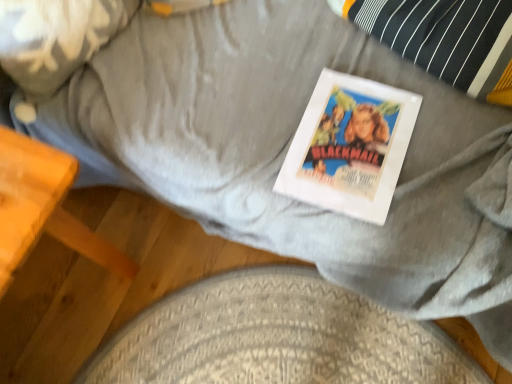
Describe the element at coordinates (350, 146) in the screenshot. Image resolution: width=512 pixels, height=384 pixels. I see `white paper at center` at that location.

The width and height of the screenshot is (512, 384). Identify the location of textured gray dog bed at lower center. (276, 337).

Where is `fluffy white pillow at upper left`? This screenshot has width=512, height=384. fluffy white pillow at upper left is located at coordinates (55, 38).

In order to face fluffy white pillow at upper left, should I rotate leftwards or rightwards?

Rotate left and turn 26.085 degrees.

Locate an element on the screen. The image size is (512, 384). wooden table at lower left is located at coordinates (44, 207).

Is textured gray dog bed at lower center far from wooden table at lower left?

No.

Would you say textured gray dog bed at lower center is outside wooden table at lower left?

Yes.

Which object is positioned more to the right, textured gray dog bed at lower center or wooden table at lower left?

textured gray dog bed at lower center is more to the right.

Between textured gray dog bed at lower center and wooden table at lower left, which one is positioned in front?

Positioned in front is wooden table at lower left.

Is white paper at center taller or shorter than fluffy white pillow at upper left?

In the image, white paper at center appears to be shorter than fluffy white pillow at upper left.

Considering the points (365, 219) and (92, 45), which point is behind, point (365, 219) or point (92, 45)?

The point (92, 45) is farther from the camera.

Considering the relative positions of white paper at center and fluffy white pillow at upper left in the image provided, is white paper at center behind fluffy white pillow at upper left?

Yes, the depth of white paper at center is greater than that of fluffy white pillow at upper left.

Consider the image. Would you say white paper at center is inside or outside fluffy white pillow at upper left?

white paper at center is outside fluffy white pillow at upper left.

Identify the location of magazine lying above the textured gray dog bed at lower center (from the image's perspective). The width and height of the screenshot is (512, 384). (350, 146).

Considering the relative sizes of textured gray dog bed at lower center and white paper at center in the image provided, is textured gray dog bed at lower center bigger than white paper at center?

Yes, textured gray dog bed at lower center is bigger than white paper at center.

Can you tell me how much textured gray dog bed at lower center and white paper at center differ in facing direction?

They differ by 1.35 degrees in their facing directions.

Is textured gray dog bed at lower center oriented away from white paper at center?

No.

Which is more to the right, fluffy white pillow at upper left or textured gray dog bed at lower center?

textured gray dog bed at lower center.

Could you tell me if fluffy white pillow at upper left is turned towards textured gray dog bed at lower center?

No, fluffy white pillow at upper left is not aimed at textured gray dog bed at lower center.

What's the angular difference between fluffy white pillow at upper left and textured gray dog bed at lower center's facing directions?

64.3 degrees.

Looking at this image, which of these two, fluffy white pillow at upper left or textured gray dog bed at lower center, is smaller?

With smaller size is textured gray dog bed at lower center.

Between white paper at center and wooden table at lower left, which one has larger width?

Wider between the two is wooden table at lower left.

Is white paper at center in front of or behind wooden table at lower left in the image?

Visually, white paper at center is located behind wooden table at lower left.

Can you tell me how much white paper at center and wooden table at lower left differ in facing direction?

86.2 degrees separate the facing orientations of white paper at center and wooden table at lower left.

Which of these two, wooden table at lower left or fluffy white pillow at upper left, stands taller?

wooden table at lower left is taller.

Where is `pillow behind the wooden table at lower left`? pillow behind the wooden table at lower left is located at coordinates (55, 38).

Is wooden table at lower left bigger or smaller than fluffy white pillow at upper left?

wooden table at lower left is bigger than fluffy white pillow at upper left.

What's the angular difference between wooden table at lower left and fluffy white pillow at upper left's facing directions?

The angular difference between wooden table at lower left and fluffy white pillow at upper left is 20.6 degrees.

Between point (111, 37) and point (300, 163), which one is positioned behind?

The point (111, 37) is more distant.

Considering the sizes of objects fluffy white pillow at upper left and white paper at center in the image provided, who is bigger, fluffy white pillow at upper left or white paper at center?

Bigger between the two is fluffy white pillow at upper left.

Which object is positioned more to the left, fluffy white pillow at upper left or white paper at center?

Result: fluffy white pillow at upper left.

At what (x,y) coordinates should I click in order to perform the action: click on furniture above the textured gray dog bed at lower center (from a real-world perspective). Please return your answer as a coordinate pair (x, y). The width and height of the screenshot is (512, 384). Looking at the image, I should click on (44, 207).

The width and height of the screenshot is (512, 384). In order to click on magazine behind the fluffy white pillow at upper left in this screenshot , I will do [x=350, y=146].

Considering their positions, is textured gray dog bed at lower center positioned closer to wooden table at lower left than fluffy white pillow at upper left?

Among the two, fluffy white pillow at upper left is located nearer to wooden table at lower left.

Looking at the image, which one is located further to textured gray dog bed at lower center, wooden table at lower left or fluffy white pillow at upper left?

fluffy white pillow at upper left.

Which object lies nearer to the anchor point wooden table at lower left, fluffy white pillow at upper left or white paper at center?

fluffy white pillow at upper left.

Which object lies nearer to the anchor point fluffy white pillow at upper left, textured gray dog bed at lower center or wooden table at lower left?

wooden table at lower left is positioned closer to the anchor fluffy white pillow at upper left.

Estimate the real-world distances between objects in this image. Which object is closer to wooden table at lower left, fluffy white pillow at upper left or textured gray dog bed at lower center?

fluffy white pillow at upper left is positioned closer to the anchor wooden table at lower left.

Based on their spatial positions, is textured gray dog bed at lower center or white paper at center further from fluffy white pillow at upper left?

The object further to fluffy white pillow at upper left is textured gray dog bed at lower center.

Considering their positions, is wooden table at lower left positioned further to fluffy white pillow at upper left than textured gray dog bed at lower center?

Among the two, textured gray dog bed at lower center is located further to fluffy white pillow at upper left.

Considering their positions, is fluffy white pillow at upper left positioned closer to white paper at center than wooden table at lower left?

wooden table at lower left is positioned closer to the anchor white paper at center.

Locate an element on the screen. The image size is (512, 384). furniture between fluffy white pillow at upper left and textured gray dog bed at lower center from top to bottom is located at coordinates (44, 207).

In order to click on pillow located between wooden table at lower left and white paper at center in the left-right direction in this screenshot , I will do `click(55, 38)`.

This screenshot has height=384, width=512. In order to click on magazine between fluffy white pillow at upper left and textured gray dog bed at lower center vertically in this screenshot , I will do `click(350, 146)`.

Where is `dog bed between wooden table at lower left and white paper at center`? Image resolution: width=512 pixels, height=384 pixels. dog bed between wooden table at lower left and white paper at center is located at coordinates (276, 337).